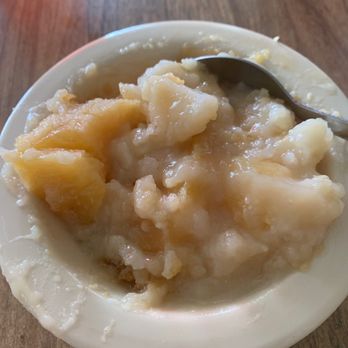
Find the location of `tabletop`. tabletop is located at coordinates (332, 331), (17, 327), (326, 49).